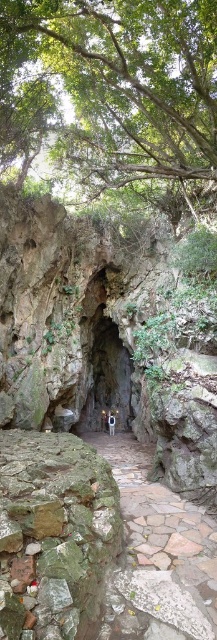
Question: Among these objects, which one is farthest from the camera?

Choices:
 (A) white plastic bag at center
 (B) green leafy tree at upper center
 (C) rough stone cave at center

Answer: (A)

Question: Can you confirm if green leafy tree at upper center is smaller than brown stone path at center?

Choices:
 (A) no
 (B) yes

Answer: (A)

Question: Which of these objects is positioned farthest from the green leafy tree at upper center?

Choices:
 (A) brown stone path at center
 (B) white plastic bag at center
 (C) rough stone cave at center

Answer: (B)

Question: Which object is the farthest from the white plastic bag at center?

Choices:
 (A) green leafy tree at upper center
 (B) rough stone cave at center
 (C) brown stone path at center

Answer: (C)

Question: Does rough stone cave at center have a smaller size compared to white plastic bag at center?

Choices:
 (A) yes
 (B) no

Answer: (B)

Question: Can you confirm if brown stone path at center is wider than white plastic bag at center?

Choices:
 (A) no
 (B) yes

Answer: (B)